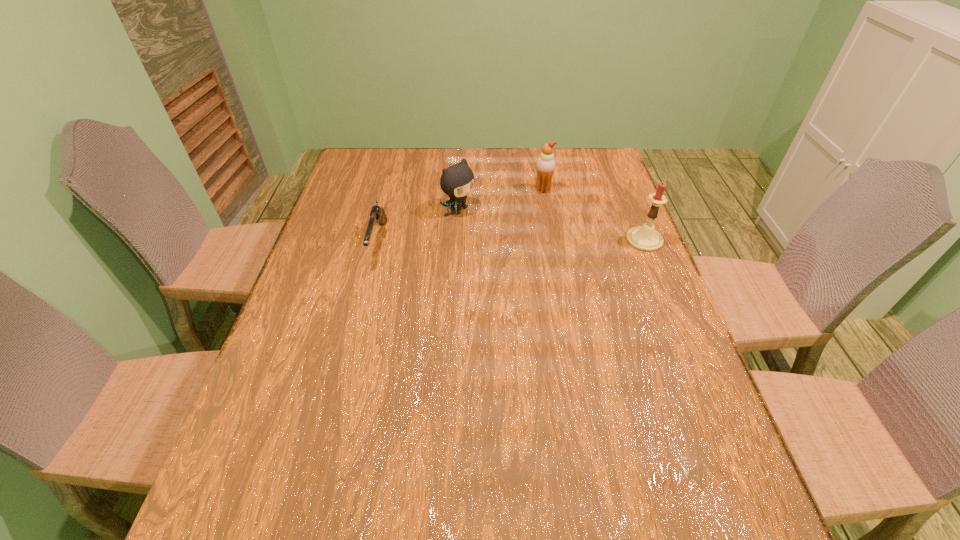
The image size is (960, 540). What are the coordinates of `free space between the leftmost object and the candle` in the screenshot? It's located at (512, 241).

Identify which object is the third nearest to the third object from right to left. Please provide its 2D coordinates. Your answer should be formatted as a tuple, i.e. [(x, y)], where the tuple contains the x and y coordinates of a point satisfying the conditions above.

[(646, 238)]

Locate which object ranks second in proximity to the shortest object. Please provide its 2D coordinates. Your answer should be formatted as a tuple, i.e. [(x, y)], where the tuple contains the x and y coordinates of a point satisfying the conditions above.

[(545, 166)]

Image resolution: width=960 pixels, height=540 pixels. I want to click on blank area in the image that satisfies the following two spatial constraints: 1. on the back side of the farthest object; 2. on the left side of the kitten, so click(x=462, y=190).

Locate an element on the screen. The height and width of the screenshot is (540, 960). vacant space that satisfies the following two spatial constraints: 1. on the front side of the rightmost object; 2. on the left side of the farthest object is located at coordinates (552, 240).

Find the location of a particular element. The image size is (960, 540). free point that satisfies the following two spatial constraints: 1. on the back side of the kitten; 2. on the left side of the icecream is located at coordinates (462, 190).